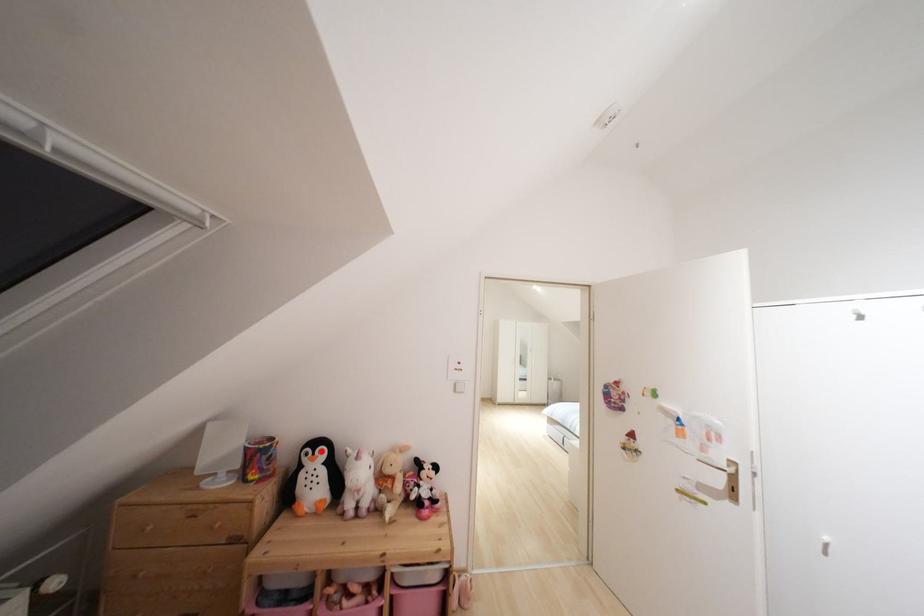
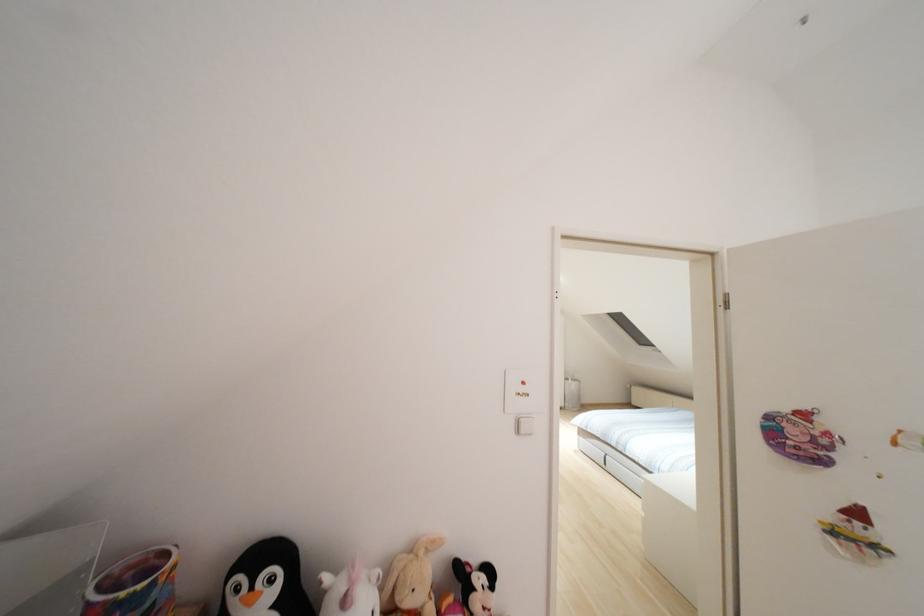
Question: I am providing you with two images of the same scene from different viewpoints. A red point is marked on the first image. Is the red point's position out of view in image 2?

Choices:
 (A) Yes
 (B) No

Answer: (B)